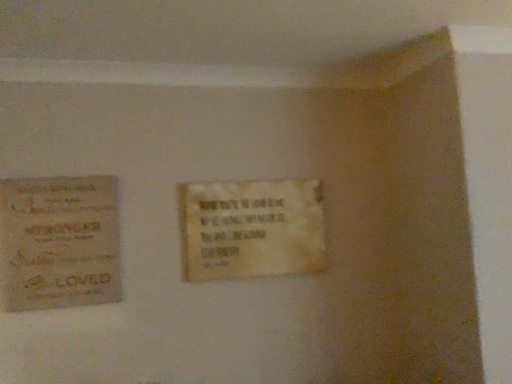
Question: Considering the relative positions of white paper plaque at center and matte paper poster at left in the image provided, is white paper plaque at center to the left of matte paper poster at left from the viewer's perspective?

Choices:
 (A) no
 (B) yes

Answer: (A)

Question: From the image's perspective, does white paper plaque at center appear lower than matte paper poster at left?

Choices:
 (A) no
 (B) yes

Answer: (A)

Question: Is white paper plaque at center positioned before matte paper poster at left?

Choices:
 (A) yes
 (B) no

Answer: (B)

Question: Can you confirm if white paper plaque at center is bigger than matte paper poster at left?

Choices:
 (A) yes
 (B) no

Answer: (A)

Question: Could you tell me if white paper plaque at center is turned towards matte paper poster at left?

Choices:
 (A) yes
 (B) no

Answer: (B)

Question: Is white paper plaque at center shorter than matte paper poster at left?

Choices:
 (A) yes
 (B) no

Answer: (A)

Question: Is matte paper poster at left next to white paper plaque at center?

Choices:
 (A) no
 (B) yes

Answer: (A)

Question: Is matte paper poster at left to the right of white paper plaque at center from the viewer's perspective?

Choices:
 (A) yes
 (B) no

Answer: (B)

Question: From a real-world perspective, is matte paper poster at left located higher than white paper plaque at center?

Choices:
 (A) no
 (B) yes

Answer: (A)

Question: From the image's perspective, is matte paper poster at left on top of white paper plaque at center?

Choices:
 (A) yes
 (B) no

Answer: (B)

Question: Is matte paper poster at left thinner than white paper plaque at center?

Choices:
 (A) yes
 (B) no

Answer: (B)

Question: Does matte paper poster at left come behind white paper plaque at center?

Choices:
 (A) no
 (B) yes

Answer: (A)

Question: Looking at their shapes, would you say matte paper poster at left is wider or thinner than white paper plaque at center?

Choices:
 (A) wide
 (B) thin

Answer: (A)